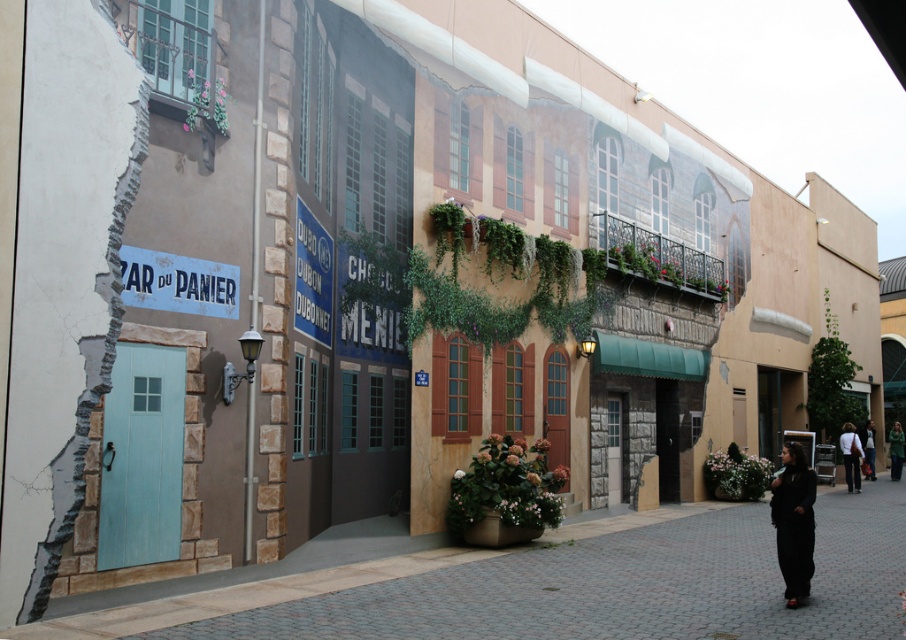
You are standing in front of the mural and notice a specific point at coordinates (794, 522). Based on the mural description, which object in the scene does this point correspond to?

The point at coordinates (794, 522) is on the black matte dress at lower right.

You are an artist trying to paint a new outfit on the lower right of the mural. You want to place a new outfit between the black matte dress at lower right and the green sweater at lower right. Which existing outfit should you place the new one closer to if you want it to be shorter than both?

The black matte dress at lower right is not as tall as the green sweater at lower right. To place the new outfit closer to one that is shorter, position it near the black matte dress at lower right.